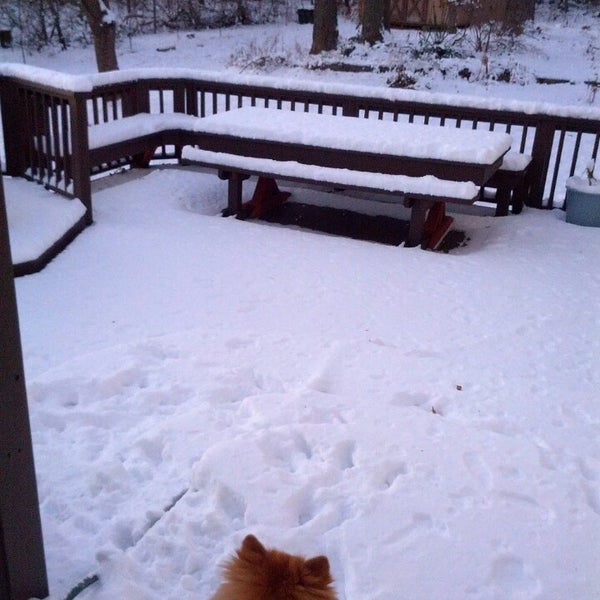
The width and height of the screenshot is (600, 600). What are the coordinates of `table` in the screenshot? It's located at (330, 136).